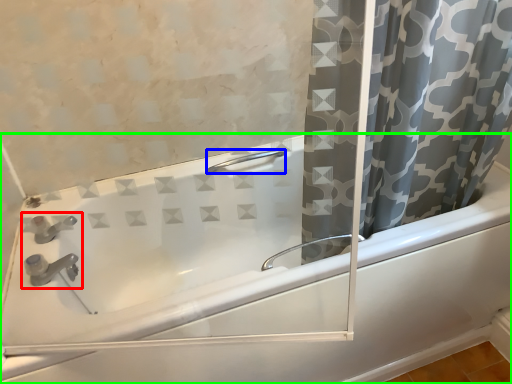
Question: Estimate the real-world distances between objects in this image. Which object is closer to sink (highlighted by a red box), shower (highlighted by a blue box) or bathtub (highlighted by a green box)?

Choices:
 (A) shower
 (B) bathtub

Answer: (B)